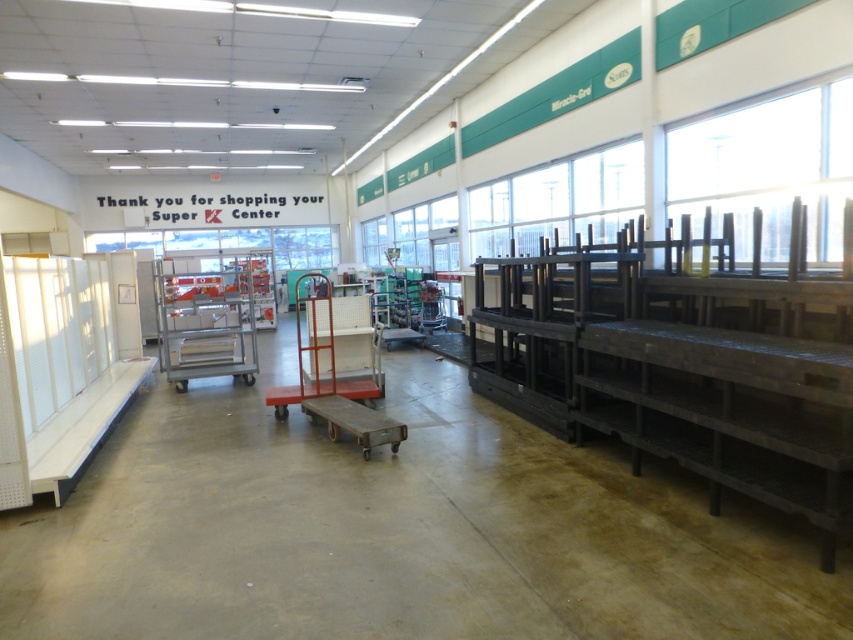
Does metallic gray cart at center have a lesser height compared to white plastic cart at center?

No.

How far apart are metallic gray cart at center and white plastic cart at center?

metallic gray cart at center and white plastic cart at center are 1.89 meters apart.

The image size is (853, 640). Describe the element at coordinates (206, 321) in the screenshot. I see `metallic gray cart at center` at that location.

Locate an element on the screen. metallic gray cart at center is located at coordinates (206, 321).